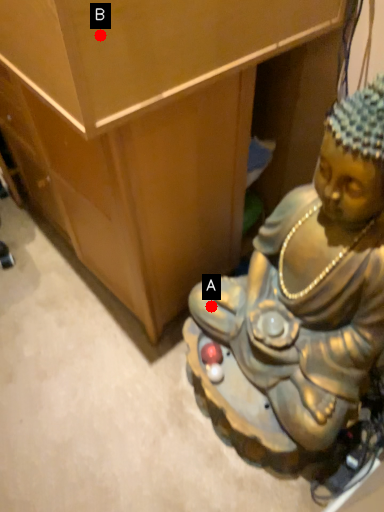
Question: Two points are circled on the image, labeled by A and B beside each circle. Which point is farther to the camera?

Choices:
 (A) A is further
 (B) B is further

Answer: (A)